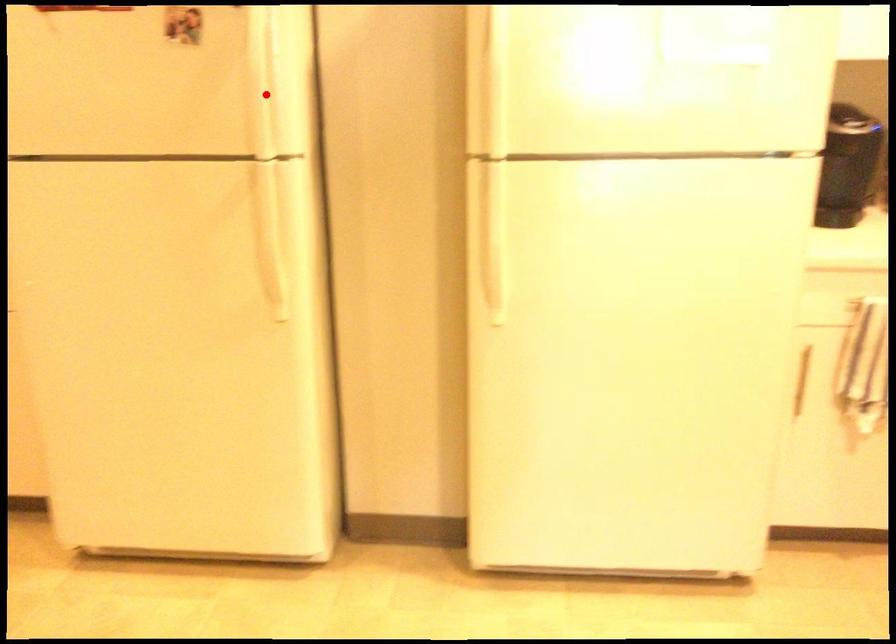
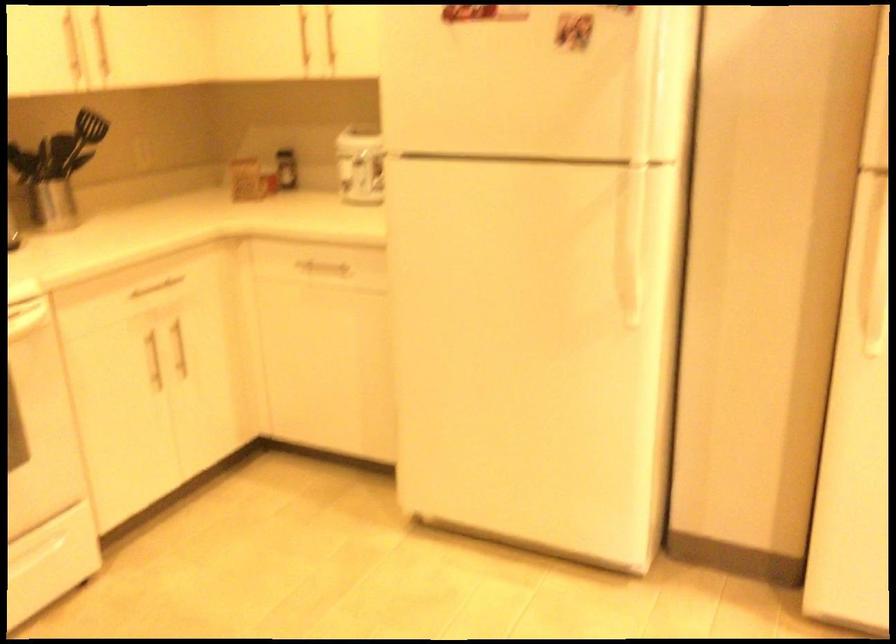
Locate, in the second image, the point that corresponds to the highlighted location in the first image.

(642, 104)